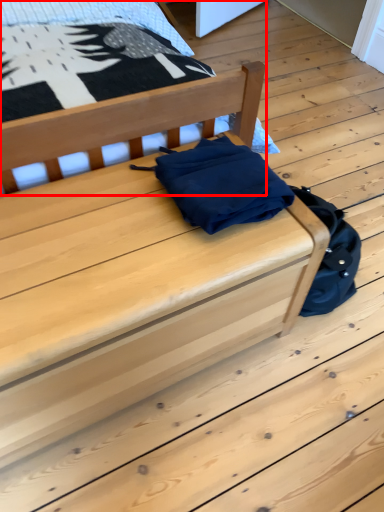
Question: From the image's perspective, where is furniture (annotated by the red box) located relative to furniture?

Choices:
 (A) below
 (B) above

Answer: (B)